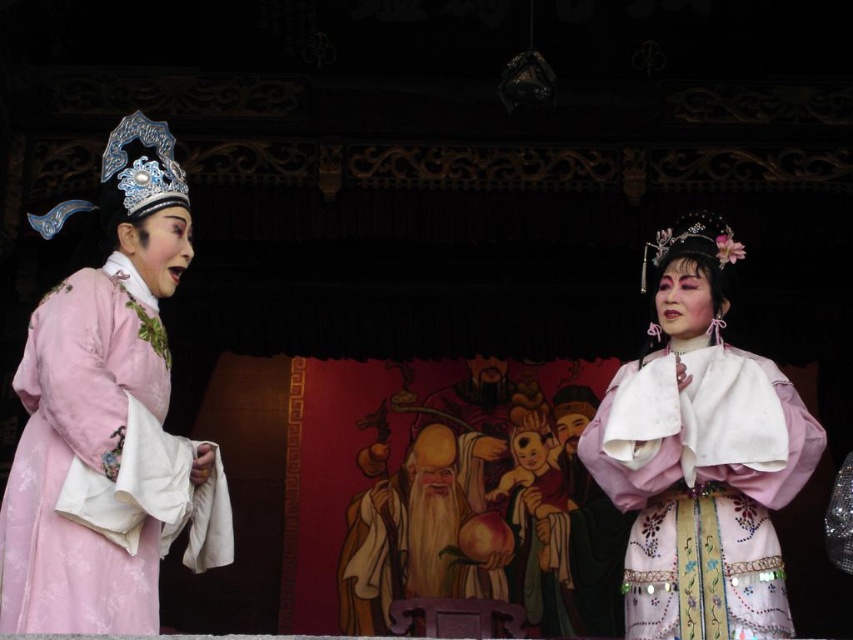
Question: Does matte pink robe at left appear on the left side of matte pink silk robe at center?

Choices:
 (A) yes
 (B) no

Answer: (A)

Question: Can you confirm if matte pink robe at left is positioned to the left of matte pink silk robe at center?

Choices:
 (A) yes
 (B) no

Answer: (A)

Question: Which object appears farthest from the camera in this image?

Choices:
 (A) matte pink silk robe at center
 (B) matte pink robe at left

Answer: (A)

Question: Which object appears farthest from the camera in this image?

Choices:
 (A) matte pink silk robe at center
 (B) matte pink robe at left

Answer: (A)

Question: Can you confirm if matte pink robe at left is positioned to the left of matte pink silk robe at center?

Choices:
 (A) yes
 (B) no

Answer: (A)